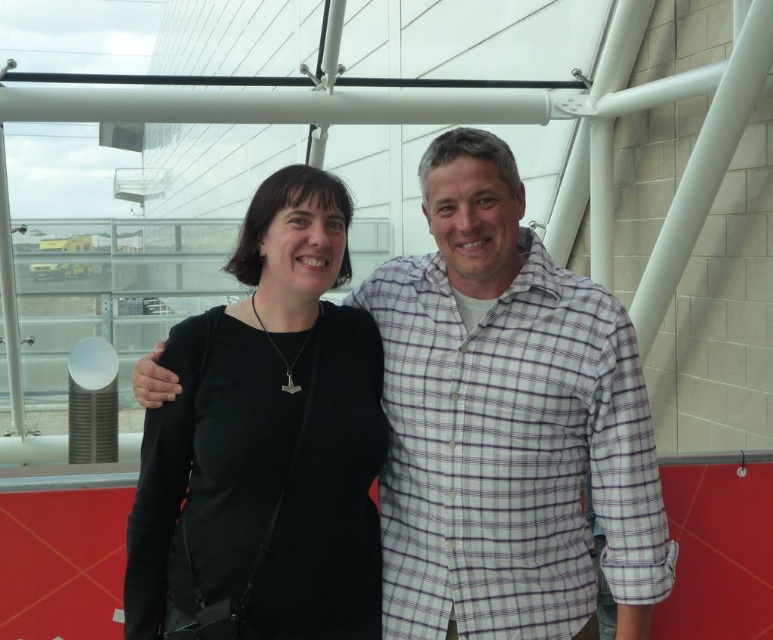
Question: Which point is farther from the camera taking this photo?

Choices:
 (A) (394, 476)
 (B) (254, 490)

Answer: (A)

Question: Can you confirm if white checkered shirt at center is positioned below black matte/black fabric at center?

Choices:
 (A) yes
 (B) no

Answer: (B)

Question: Is white checkered shirt at center above black matte/black fabric at center?

Choices:
 (A) no
 (B) yes

Answer: (B)

Question: Which of the following is the closest to the observer?

Choices:
 (A) (332, 388)
 (B) (639, 624)

Answer: (B)

Question: Among these points, which one is nearest to the camera?

Choices:
 (A) (145, 563)
 (B) (559, 312)

Answer: (B)

Question: Does white checkered shirt at center have a lesser width compared to black matte/black fabric at center?

Choices:
 (A) no
 (B) yes

Answer: (A)